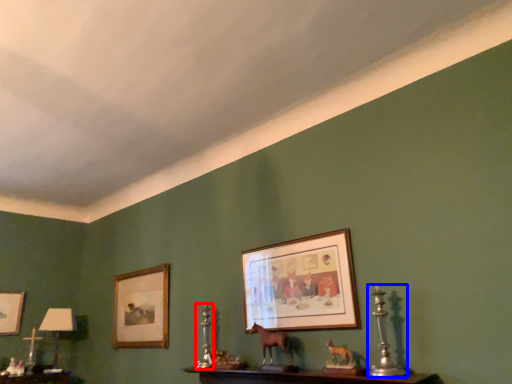
Question: Which object appears farthest to the camera in this image, candle holder (highlighted by a red box) or candle holder (highlighted by a blue box)?

Choices:
 (A) candle holder
 (B) candle holder

Answer: (A)